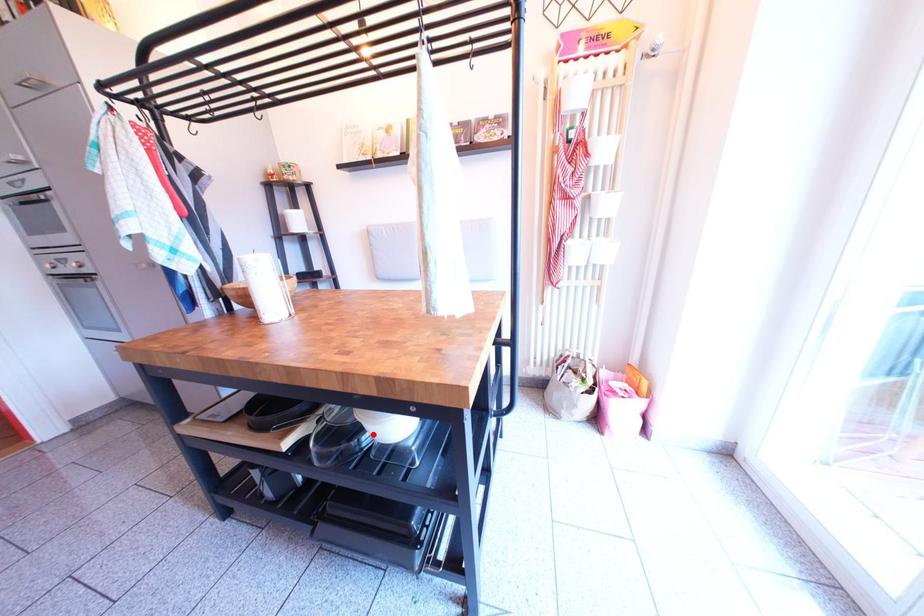
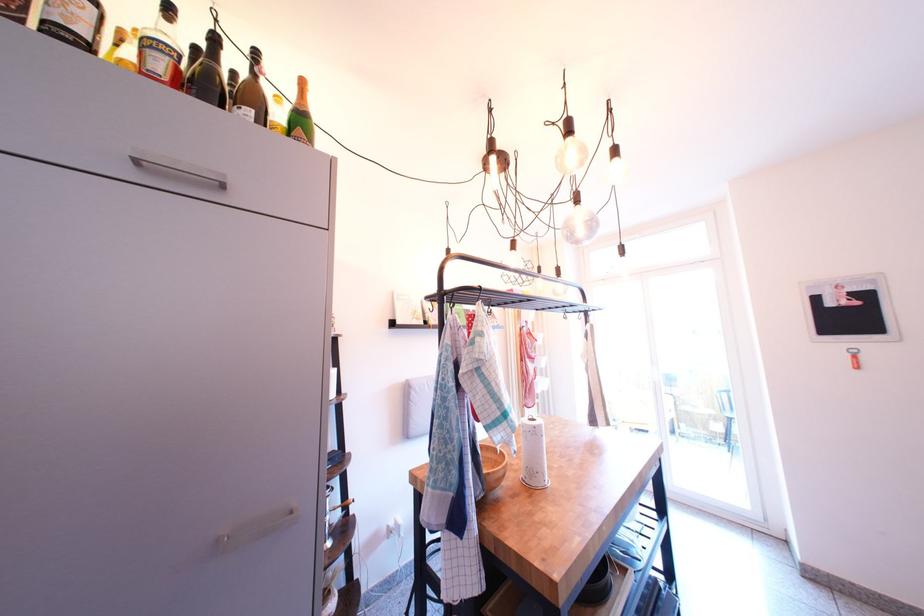
Question: I am providing you with two images of the same scene from different viewpoints. A red point is marked on the first image. Can you still see the location of the red point in image 2?

Choices:
 (A) Yes
 (B) No

Answer: (B)